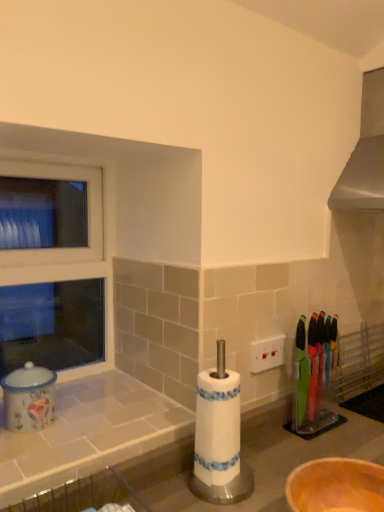
Identify the location of unoccupied area in front of matte ceramic coffee canister at left. (34, 454).